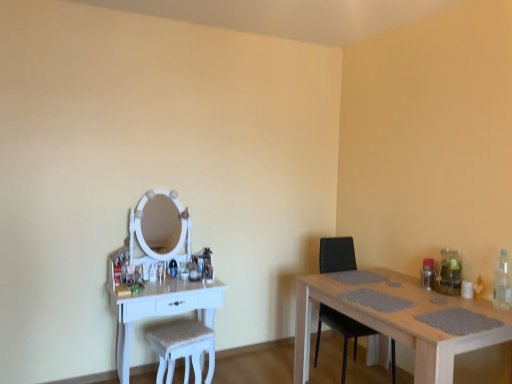
Where is `blank space situated above light brown wooden table at right, the 1th table from the right (from a real-world perspective)`? The width and height of the screenshot is (512, 384). blank space situated above light brown wooden table at right, the 1th table from the right (from a real-world perspective) is located at coordinates (402, 292).